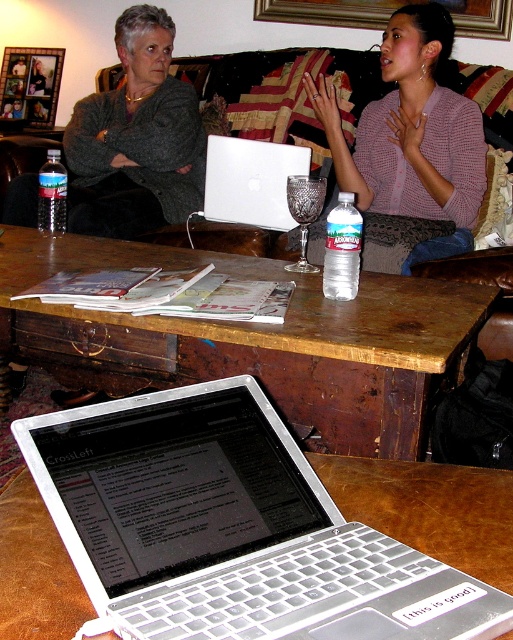
Who is higher up, velvet-like couch at center or white glossy laptop at center?

velvet-like couch at center is above.

How distant is velvet-like couch at center from white glossy laptop at center?

velvet-like couch at center is 18.14 inches away from white glossy laptop at center.

Find the location of a particular element. The height and width of the screenshot is (640, 513). velvet-like couch at center is located at coordinates (285, 88).

Who is positioned more to the right, silver metallic laptop at center or brown wooden table at center?

Positioned to the right is silver metallic laptop at center.

Who is higher up, silver metallic laptop at center or brown wooden table at center?

brown wooden table at center

Who is more forward, (150, 584) or (146, 317)?

Point (150, 584)

Image resolution: width=513 pixels, height=640 pixels. In order to click on silver metallic laptop at center in this screenshot , I will do `click(230, 529)`.

Looking at this image, is matte plastic water bottle at center below velvet-like couch at center?

Yes.

Does matte plastic water bottle at center have a greater height compared to velvet-like couch at center?

In fact, matte plastic water bottle at center may be shorter than velvet-like couch at center.

Who is more forward, (477,177) or (458,77)?

Positioned in front is point (477,177).

Locate an element on the screen. Image resolution: width=513 pixels, height=640 pixels. matte plastic water bottle at center is located at coordinates (409, 148).